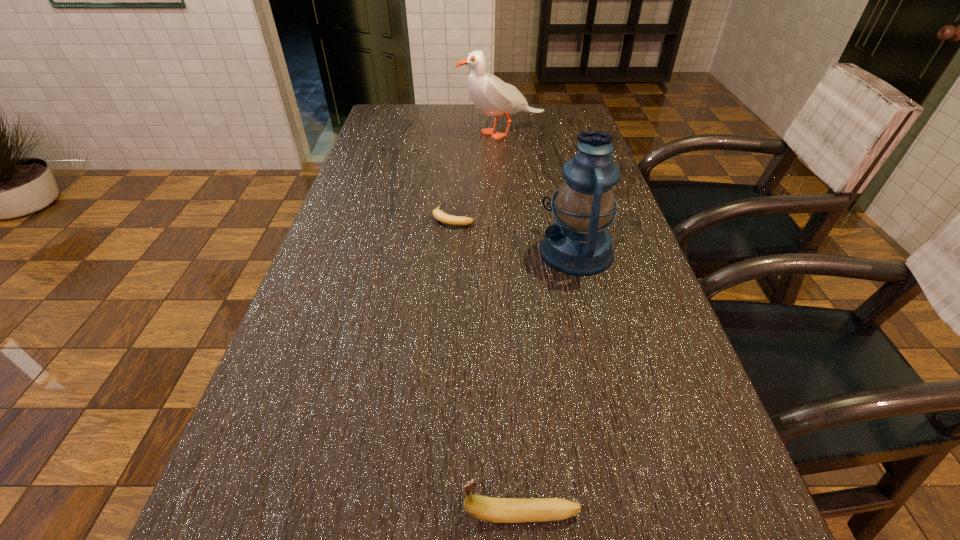
This screenshot has height=540, width=960. What are the coordinates of `empty space between the shortest object and the nearer banana` in the screenshot? It's located at (488, 366).

You are a GUI agent. You are given a task and a screenshot of the screen. Output one action in this format:
    pyautogui.click(x=<x>, y=<y>)
    Task: Click on the vacant space that is in between the shortest object and the lantern
    This screenshot has width=960, height=540.
    Given the screenshot: What is the action you would take?
    pyautogui.click(x=515, y=234)

In order to click on free space between the shortest object and the nearest object in this screenshot , I will do `click(488, 366)`.

The height and width of the screenshot is (540, 960). What are the coordinates of `free space between the nearest object and the lantern` in the screenshot? It's located at (549, 382).

The width and height of the screenshot is (960, 540). Find the location of `free area in between the shortest object and the taller banana`. free area in between the shortest object and the taller banana is located at coordinates (488, 366).

Identify the location of the closest object to the gull. (438, 214).

At what (x,y) coordinates should I click in order to perform the action: click on object that is the closest to the farthest object. Please return your answer as a coordinate pair (x, y). The height and width of the screenshot is (540, 960). Looking at the image, I should click on (438, 214).